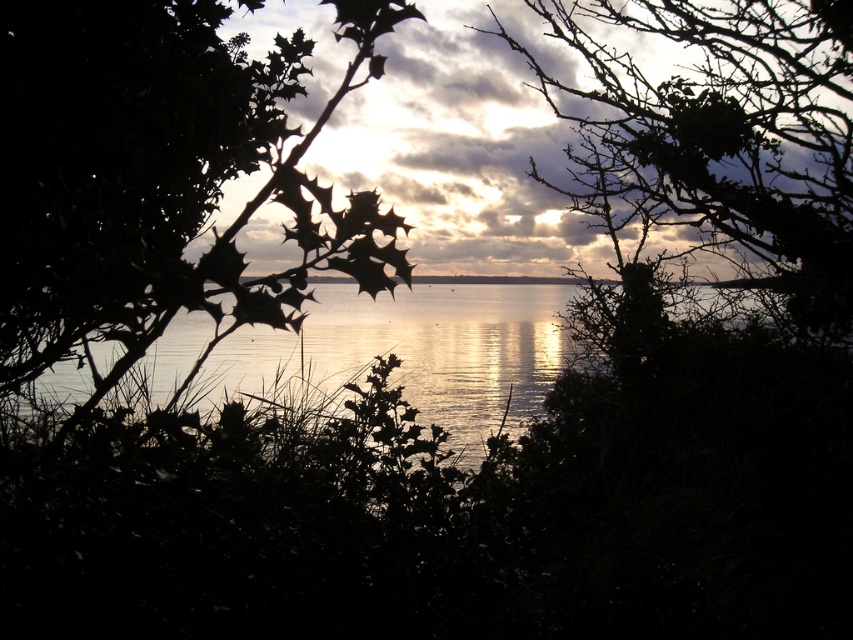
Question: Does cloudy sky at center appear on the left side of silvery reflective water at center?

Choices:
 (A) no
 (B) yes

Answer: (A)

Question: Observing the image, what is the correct spatial positioning of cloudy sky at center in reference to silvery reflective water at center?

Choices:
 (A) below
 (B) above

Answer: (B)

Question: Which point is closer to the camera taking this photo?

Choices:
 (A) (515, 355)
 (B) (355, 189)

Answer: (B)

Question: Is cloudy sky at center to the right of silvery reflective water at center from the viewer's perspective?

Choices:
 (A) no
 (B) yes

Answer: (B)